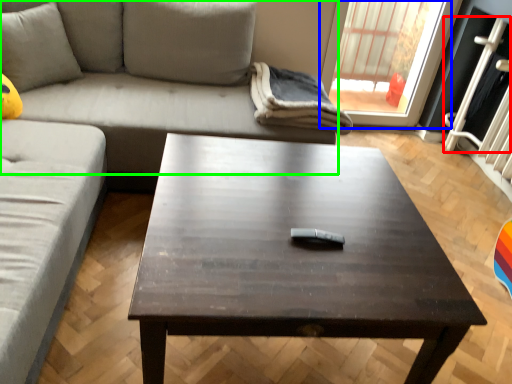
Question: Estimate the real-world distances between objects in this image. Which object is closer to screen door (highlighted by a red box), window (highlighted by a blue box) or studio couch (highlighted by a green box)?

Choices:
 (A) window
 (B) studio couch

Answer: (A)